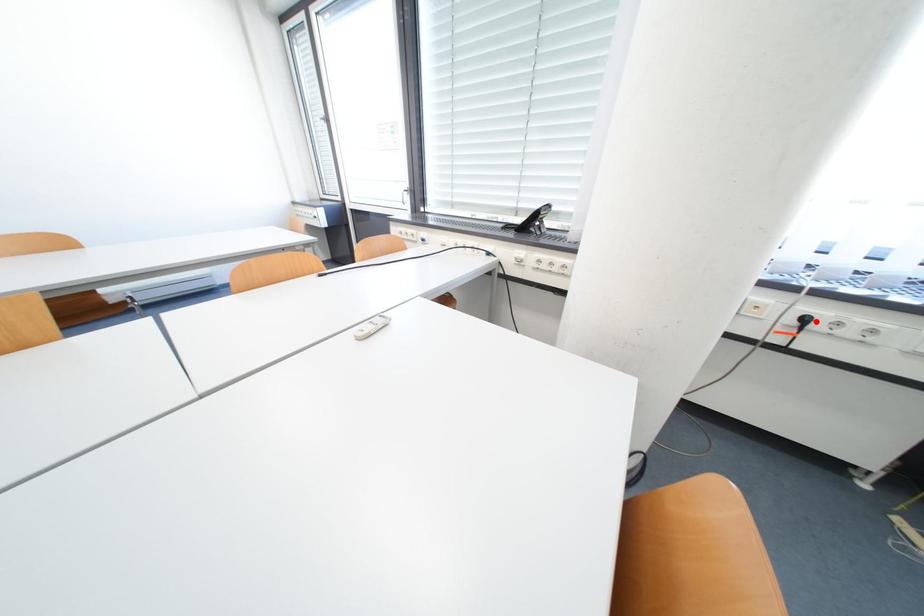
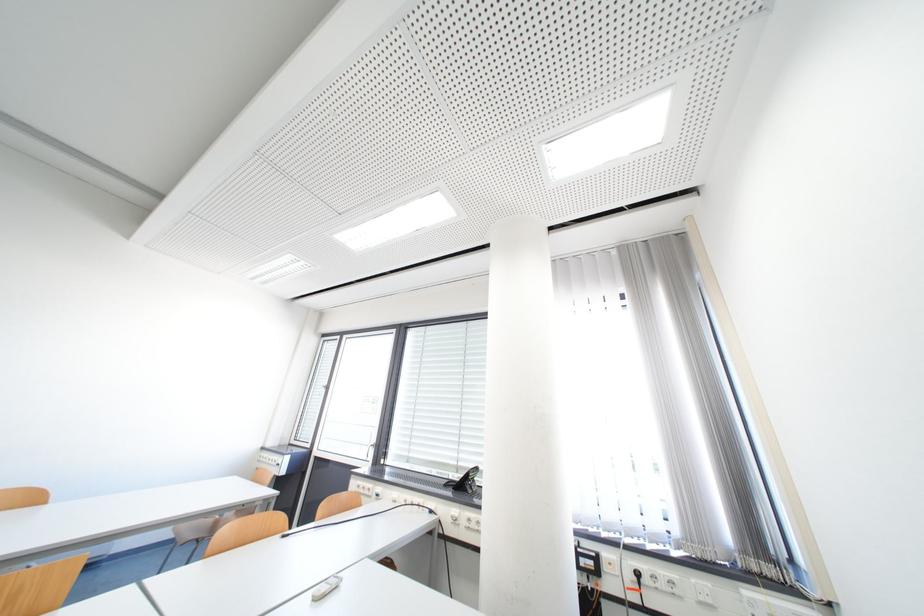
Question: I am providing you with two images of the same scene from different viewpoints. A red point is marked on the first image. Is the red point's position out of view in image 2?

Choices:
 (A) Yes
 (B) No

Answer: (B)